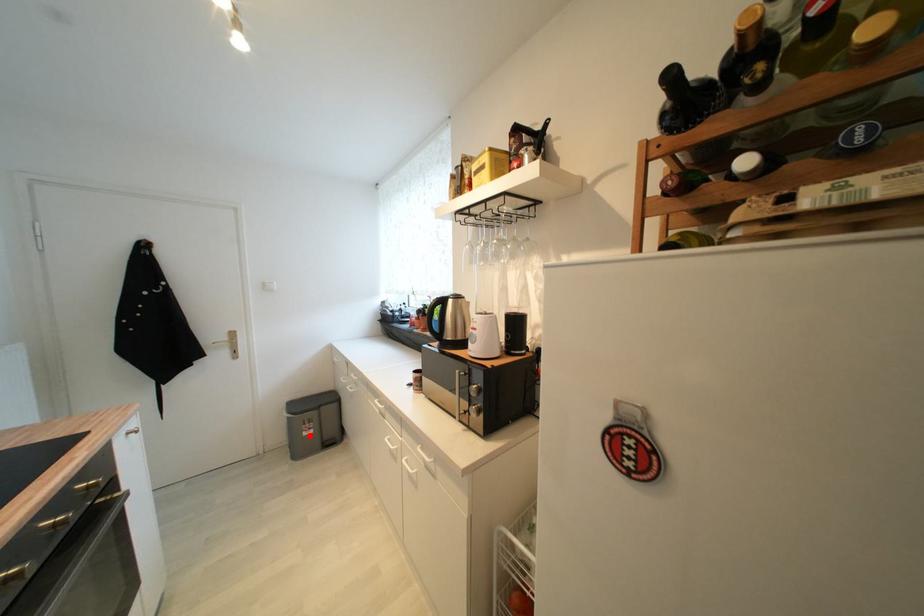
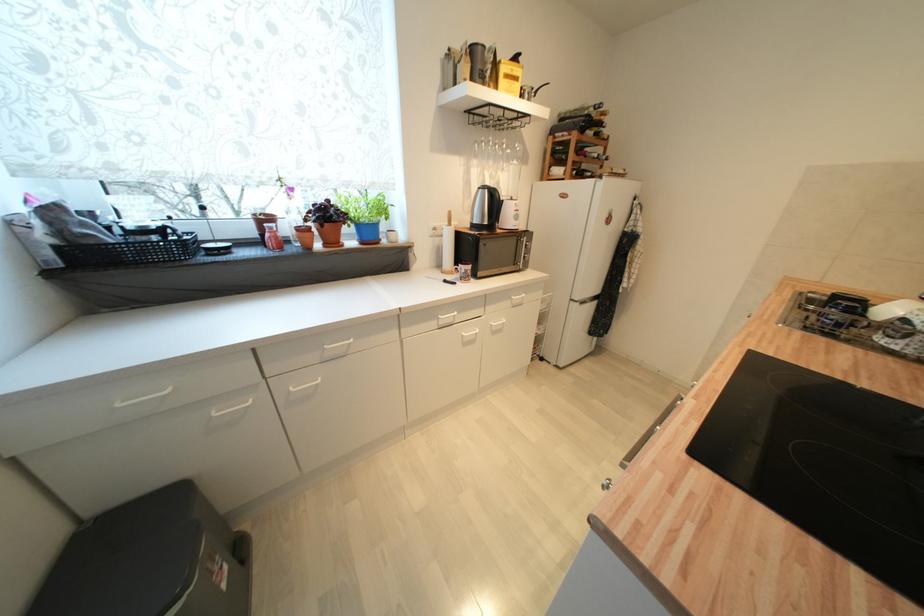
Question: I am providing you with two images of the same scene from different viewpoints. In image1, a red point is highlighted. Considering the same 3D point in image2, which of the following is correct?

Choices:
 (A) It is closer
 (B) It is farther

Answer: (B)